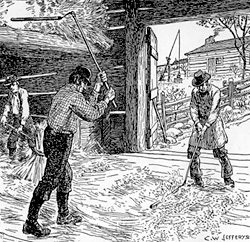
Where is `handle`? The image size is (250, 242). handle is located at coordinates (196, 152), (108, 88), (166, 132), (162, 104), (12, 123).